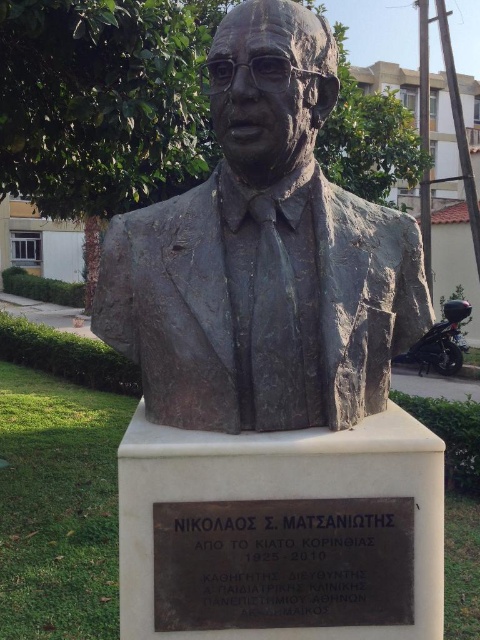
Is bronze statue at center wider than black metal plaque at center?

Yes.

Locate an element on the screen. bronze statue at center is located at coordinates (264, 256).